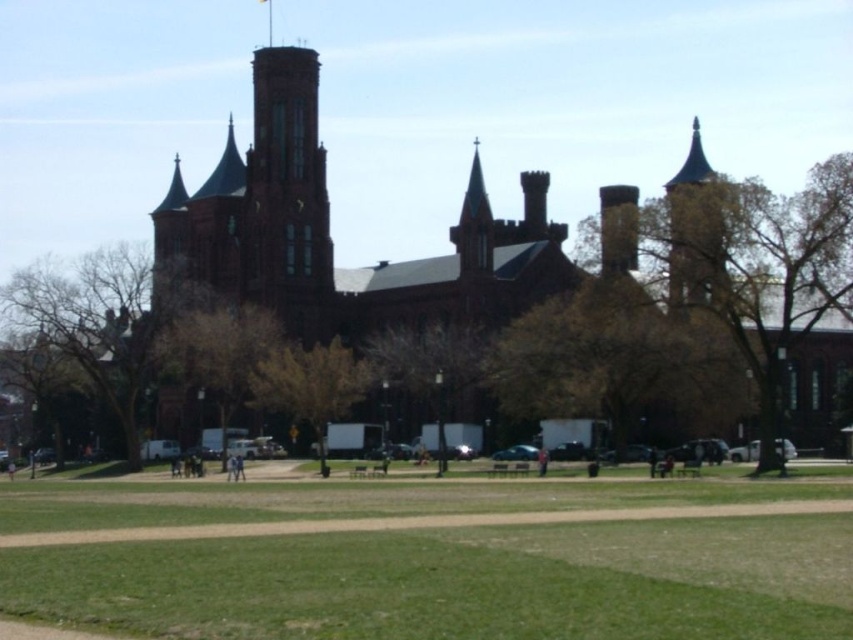
You are a landscape architect designing a garden around the historic building. You need to place a new statue that requires a base larger than the green grass at lower center. Can the brown stone tower at upper right provide a suitable base for the statue?

The brown stone tower at upper right is larger in size than the green grass at lower center, so it can provide a suitable base for the statue.

Based on the photo, you are standing in front of the historic building and want to determine the relative positions of two points marked on the image. Which point, point (500,264) or point (682,202), is closer to you?

Point (500,264) is closer to you because it is further to the viewer than point (682,202).

You are standing in the grassy area in front of the historic building. You want to take a photo that includes both the green grass at lower center and the brown stone tower at upper right. Which object should appear closer to the camera in the photo?

The green grass at lower center should appear closer to the camera in the photo because it is in front of the brown stone tower at upper right.